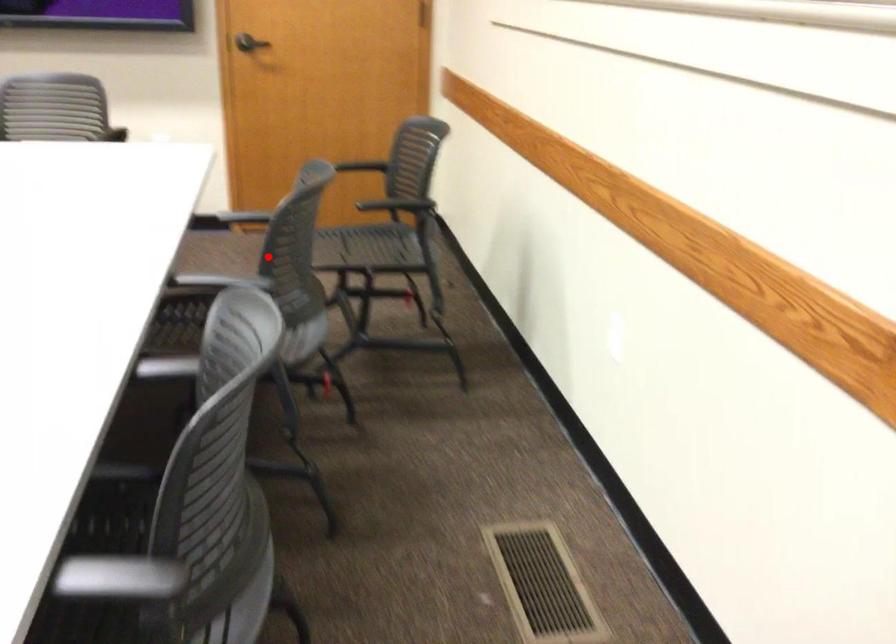
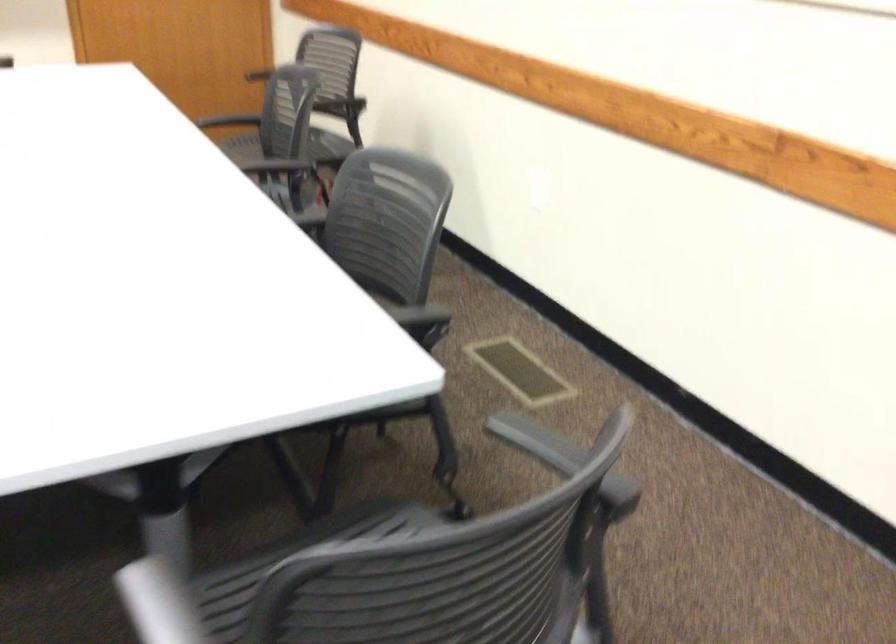
Question: I am providing you with two images of the same scene from different viewpoints. Given a red point in image1, look at the same physical point in image2. Is it:

Choices:
 (A) Closer to the viewpoint
 (B) Farther from the viewpoint

Answer: (B)